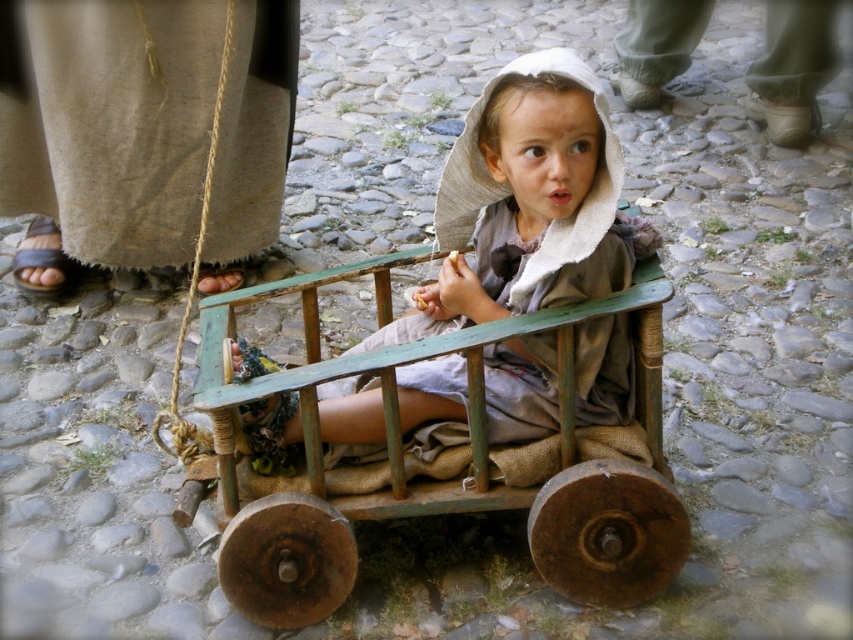
Can you confirm if green painted wood wagon at center is thinner than matte green cart at center?

No, green painted wood wagon at center is not thinner than matte green cart at center.

Is point (339, 273) positioned in front of point (512, 428)?

No, (339, 273) is further to viewer.

Find the location of `green painted wood wagon at center`. green painted wood wagon at center is located at coordinates (445, 472).